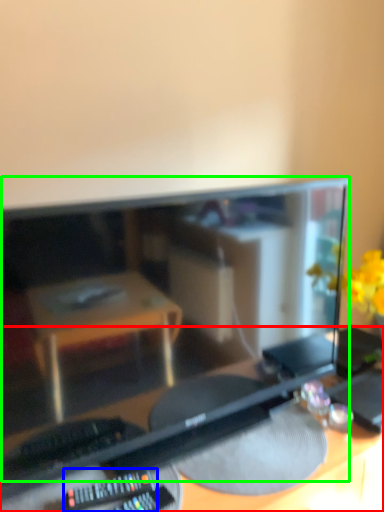
Question: Based on their relative distances, which object is farther from desk (highlighted by a red box)? Choose from control (highlighted by a blue box) and computer monitor (highlighted by a green box).

Choices:
 (A) control
 (B) computer monitor

Answer: (A)